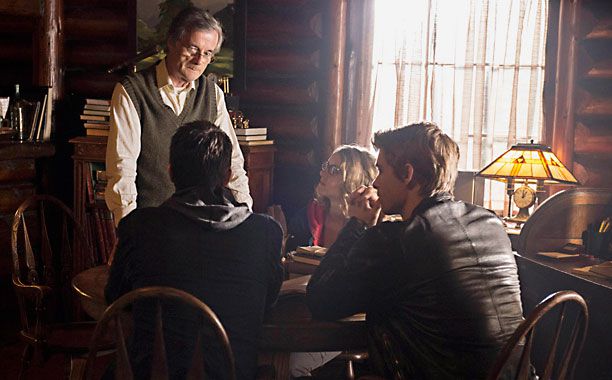
Find the location of a particular element. Image resolution: width=612 pixels, height=380 pixels. lamp is located at coordinates (524, 164).